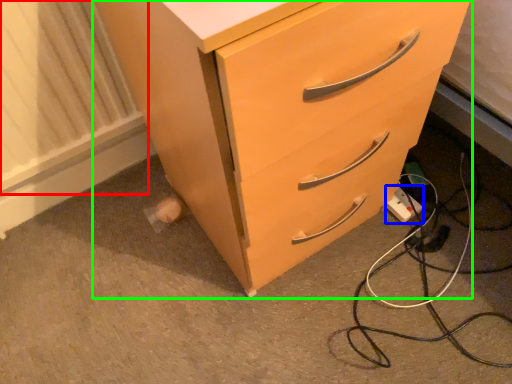
Question: Considering the real-world distances, which object is farthest from radiator (highlighted by a red box)? electric outlet (highlighted by a blue box) or chest of drawers (highlighted by a green box)?

Choices:
 (A) electric outlet
 (B) chest of drawers

Answer: (A)